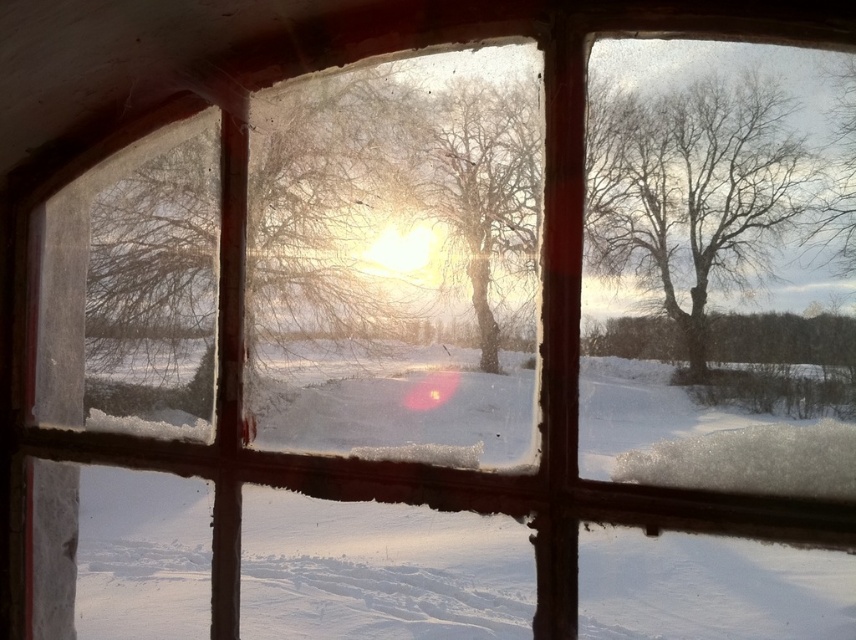
Question: Can you confirm if translucent frosted glass tree at center is wider than bare wood tree at center?

Choices:
 (A) yes
 (B) no

Answer: (A)

Question: Does translucent frosted glass tree at center appear on the right side of bare wood tree at center?

Choices:
 (A) yes
 (B) no

Answer: (B)

Question: Can you confirm if bare branches at center is positioned to the right of bare wood tree at center?

Choices:
 (A) yes
 (B) no

Answer: (A)

Question: Which point is farther to the camera?

Choices:
 (A) translucent frosted glass tree at center
 (B) bare wood tree at center
 (C) bare branches at center

Answer: (A)

Question: Estimate the real-world distances between objects in this image. Which object is farther from the translucent frosted glass tree at center?

Choices:
 (A) bare branches at center
 (B) bare wood tree at center

Answer: (A)

Question: Which point is farther from the camera taking this photo?

Choices:
 (A) (94, 225)
 (B) (746, 234)

Answer: (A)